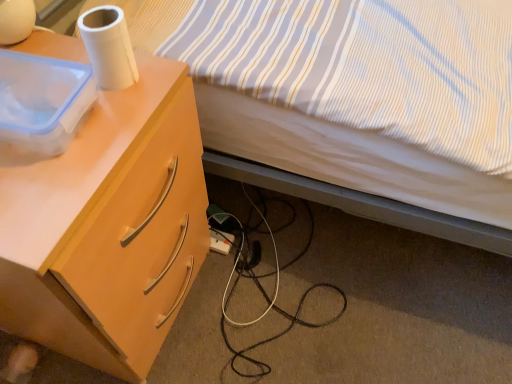
Question: From the image's perspective, is light wood/finish desk at left on top of white plastic power outlet at lower center?

Choices:
 (A) yes
 (B) no

Answer: (A)

Question: From the image's perspective, is light wood/finish desk at left below white plastic power outlet at lower center?

Choices:
 (A) no
 (B) yes

Answer: (A)

Question: From a real-world perspective, is light wood/finish desk at left on white plastic power outlet at lower center?

Choices:
 (A) no
 (B) yes

Answer: (B)

Question: Does light wood/finish desk at left have a lesser height compared to white plastic power outlet at lower center?

Choices:
 (A) no
 (B) yes

Answer: (A)

Question: Considering the relative sizes of light wood/finish desk at left and white plastic power outlet at lower center in the image provided, is light wood/finish desk at left thinner than white plastic power outlet at lower center?

Choices:
 (A) no
 (B) yes

Answer: (A)

Question: Does light wood/finish desk at left have a greater height compared to white plastic power outlet at lower center?

Choices:
 (A) yes
 (B) no

Answer: (A)

Question: From a real-world perspective, is light wood/finish desk at left beneath white matte paper towel at upper left?

Choices:
 (A) no
 (B) yes

Answer: (B)

Question: Can you confirm if light wood/finish desk at left is positioned to the left of white matte paper towel at upper left?

Choices:
 (A) yes
 (B) no

Answer: (A)

Question: Is light wood/finish desk at left taller than white matte paper towel at upper left?

Choices:
 (A) yes
 (B) no

Answer: (A)

Question: From the image's perspective, would you say light wood/finish desk at left is shown under white matte paper towel at upper left?

Choices:
 (A) yes
 (B) no

Answer: (A)

Question: Is the position of light wood/finish desk at left less distant than that of white matte paper towel at upper left?

Choices:
 (A) yes
 (B) no

Answer: (A)

Question: Does light wood/finish desk at left have a larger size compared to white matte paper towel at upper left?

Choices:
 (A) no
 (B) yes

Answer: (B)

Question: Considering the relative sizes of striped fabric bed at upper right and white plastic power outlet at lower center in the image provided, is striped fabric bed at upper right smaller than white plastic power outlet at lower center?

Choices:
 (A) yes
 (B) no

Answer: (B)